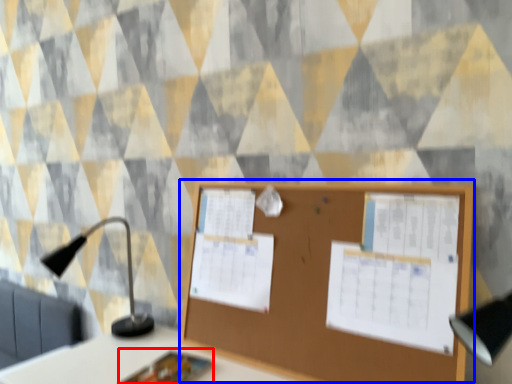
Question: Which point is further to the camera, notebook (highlighted by a red box) or bulletin board (highlighted by a blue box)?

Choices:
 (A) notebook
 (B) bulletin board

Answer: (A)